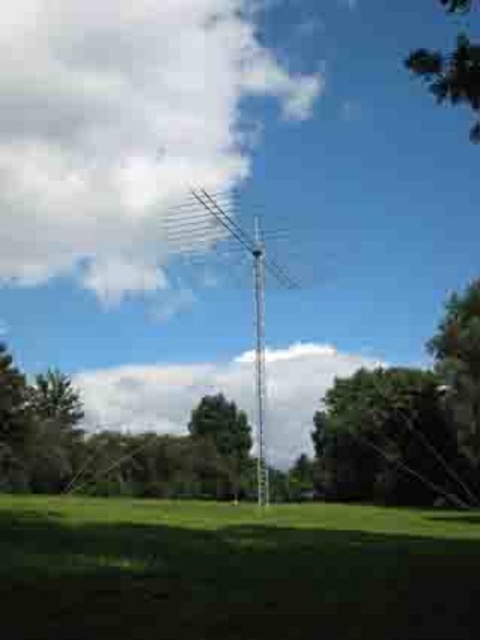
Is green grassy at lower center to the left of green leafy tree at upper right from the viewer's perspective?

→ Yes, green grassy at lower center is to the left of green leafy tree at upper right.

Is green grassy at lower center further to camera compared to green leafy tree at upper right?

No.

Describe the element at coordinates (235, 570) in the screenshot. I see `green grassy at lower center` at that location.

You are a GUI agent. You are given a task and a screenshot of the screen. Output one action in this format:
    pyautogui.click(x=<x>, y=<y>)
    Task: Click on the green grassy at lower center
    Image resolution: width=480 pixels, height=640 pixels.
    Given the screenshot: What is the action you would take?
    pyautogui.click(x=235, y=570)

Describe the element at coordinates (235, 570) in the screenshot. I see `green grassy at lower center` at that location.

Is green grassy at lower center to the right of green leafy tree at center from the viewer's perspective?

Correct, you'll find green grassy at lower center to the right of green leafy tree at center.

Does point (60, 513) lie in front of point (228, 433)?

Yes, point (60, 513) is in front of point (228, 433).

Where is `green grassy at lower center`? The height and width of the screenshot is (640, 480). green grassy at lower center is located at coordinates (235, 570).

Between green grassy at lower center and silver metallic antenna at center, which one appears on the left side from the viewer's perspective?

green grassy at lower center

Which is more to the right, green grassy at lower center or silver metallic antenna at center?

silver metallic antenna at center

Who is more distant from viewer, (x=60, y=625) or (x=242, y=234)?

The point (x=242, y=234) is more distant.

I want to click on green grassy at lower center, so click(x=235, y=570).